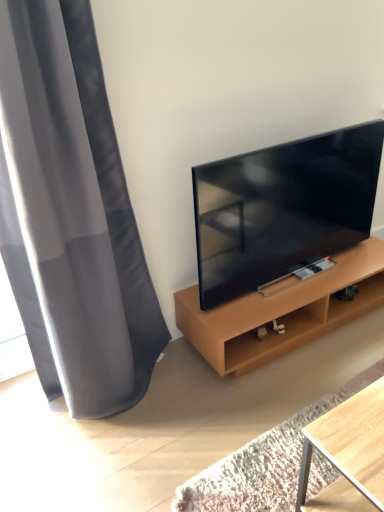
The width and height of the screenshot is (384, 512). I want to click on gray fabric curtain at left, so click(71, 214).

Find the location of a particular element. matte black tv at right is located at coordinates (283, 208).

Is point (185, 328) positioned before point (30, 115)?

No, (185, 328) is further to viewer.

Considering the relative sizes of wooden shelf at right and gray fabric curtain at left in the image provided, is wooden shelf at right bigger than gray fabric curtain at left?

No.

Looking at this image, how different are the orientations of wooden shelf at right and gray fabric curtain at left in degrees?

0.000275 degrees.

Would you say wooden shelf at right is inside or outside gray fabric curtain at left?

wooden shelf at right is outside gray fabric curtain at left.

Considering the sizes of objects matte black tv at right and gray fabric curtain at left in the image provided, who is bigger, matte black tv at right or gray fabric curtain at left?

gray fabric curtain at left is bigger.

Measure the distance between matte black tv at right and gray fabric curtain at left.

25.34 inches.

Is matte black tv at right taller or shorter than gray fabric curtain at left?

matte black tv at right is shorter than gray fabric curtain at left.

The width and height of the screenshot is (384, 512). Identify the location of shelf behind the gray fabric curtain at left. (282, 312).

From a real-world perspective, is gray fabric curtain at left located beneath wooden shelf at right?

No, from a real-world perspective, gray fabric curtain at left is not beneath wooden shelf at right.

Does gray fabric curtain at left appear on the right side of wooden shelf at right?

In fact, gray fabric curtain at left is to the left of wooden shelf at right.

From the image's perspective, which is above, gray fabric curtain at left or wooden shelf at right?

From the image's view, gray fabric curtain at left is above.

Is gray fabric curtain at left turned away from matte black tv at right?

gray fabric curtain at left does not have its back to matte black tv at right.

Does point (126, 399) come in front of point (244, 246)?

Yes, it is.

Is gray fabric curtain at left bigger or smaller than matte black tv at right?

In the image, gray fabric curtain at left appears to be larger than matte black tv at right.

Is gray fabric curtain at left to the right of matte black tv at right from the viewer's perspective?

Incorrect, gray fabric curtain at left is not on the right side of matte black tv at right.

I want to click on television positioned vertically above the wooden shelf at right (from a real-world perspective), so click(283, 208).

Is point (229, 207) positioned in front of point (352, 282)?

Yes, point (229, 207) is closer to viewer.

Considering the sizes of objects matte black tv at right and wooden shelf at right in the image provided, who is shorter, matte black tv at right or wooden shelf at right?

wooden shelf at right.

Which is in front, point (272, 305) or point (236, 185)?

Point (236, 185)

Between wooden shelf at right and matte black tv at right, which one appears on the right side from the viewer's perspective?

wooden shelf at right.

In order to click on television in front of the wooden shelf at right in this screenshot , I will do `click(283, 208)`.

At what (x,y) coordinates should I click in order to perform the action: click on shelf on the right of gray fabric curtain at left. Please return your answer as a coordinate pair (x, y). Image resolution: width=384 pixels, height=512 pixels. Looking at the image, I should click on (282, 312).

Identify the location of curtain in front of the matte black tv at right. This screenshot has height=512, width=384. (71, 214).

Consider the image. Estimate the real-world distances between objects in this image. Which object is closer to wooden shelf at right, matte black tv at right or gray fabric curtain at left?

Based on the image, matte black tv at right appears to be nearer to wooden shelf at right.

Which object lies further to the anchor point matte black tv at right, wooden shelf at right or gray fabric curtain at left?

gray fabric curtain at left lies further to matte black tv at right than the other object.

From the image, which object appears to be farther from gray fabric curtain at left, matte black tv at right or wooden shelf at right?

The object further to gray fabric curtain at left is wooden shelf at right.

Considering their positions, is gray fabric curtain at left positioned further to wooden shelf at right than matte black tv at right?

Among the two, gray fabric curtain at left is located further to wooden shelf at right.

Considering their positions, is gray fabric curtain at left positioned further to matte black tv at right than wooden shelf at right?

gray fabric curtain at left is further to matte black tv at right.

Estimate the real-world distances between objects in this image. Which object is closer to gray fabric curtain at left, wooden shelf at right or matte black tv at right?

Among the two, matte black tv at right is located nearer to gray fabric curtain at left.

Locate an element on the screen. Image resolution: width=384 pixels, height=512 pixels. television situated between gray fabric curtain at left and wooden shelf at right from left to right is located at coordinates (283, 208).